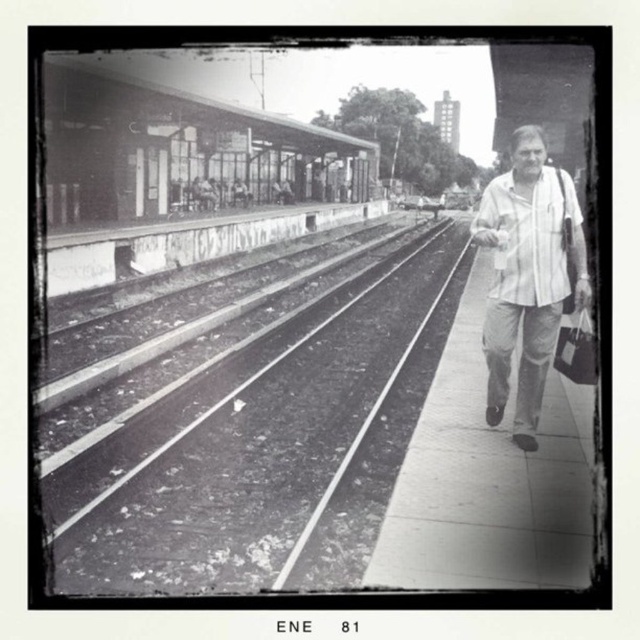
You are a photographer standing at the train station. You notice the smooth concrete tracks at center and the white cotton shirt at right in your viewfinder. Which object would appear larger in your photo if you focus on them equally?

The smooth concrete tracks at center would appear larger in the photo because they are wider than the white cotton shirt at right.

Based on the scene, if the man in the white cotton shirt at right continues walking forward along the platform, will his feet eventually touch the smooth concrete tracks at center?

Yes, because the smooth concrete tracks at center are positioned below the white cotton shirt at right, indicating they are on the same level or lower, so as the man walks forward, his path would lead towards the tracks.

You are standing on the platform and want to know which object is taller between the smooth concrete tracks at center and the white cotton shirt at right. Can you determine this based on the scene?

The smooth concrete tracks at center is not as tall as the white cotton shirt at right, so the white cotton shirt at right is taller.